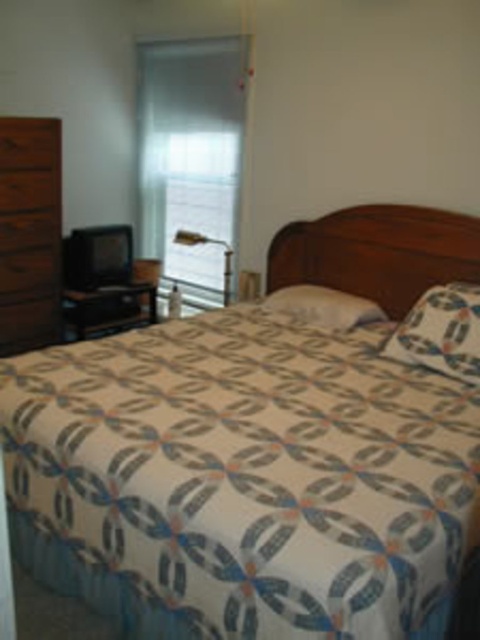
Question: Based on their relative distances, which object is nearer to the wooden dresser at left?

Choices:
 (A) patterned fabric bed at center
 (B) metallic gold lamp at upper center
 (C) white textured pillow at center

Answer: (B)

Question: Does patterned fabric bed at center appear on the right side of patterned fabric pillow at center?

Choices:
 (A) yes
 (B) no

Answer: (B)

Question: Is wooden dresser at left smaller than patterned fabric pillow at center?

Choices:
 (A) yes
 (B) no

Answer: (B)

Question: Which of these objects is positioned farthest from the wooden dresser at left?

Choices:
 (A) patterned fabric bed at center
 (B) white textured pillow at center
 (C) patterned fabric pillow at center
 (D) metallic gold lamp at upper center

Answer: (C)

Question: Among these points, which one is nearest to the camera?

Choices:
 (A) (190, 237)
 (B) (343, 307)
 (C) (420, 218)
 (D) (1, 323)

Answer: (B)

Question: Is the position of wooden dresser at left less distant than that of patterned fabric pillow at center?

Choices:
 (A) yes
 (B) no

Answer: (B)